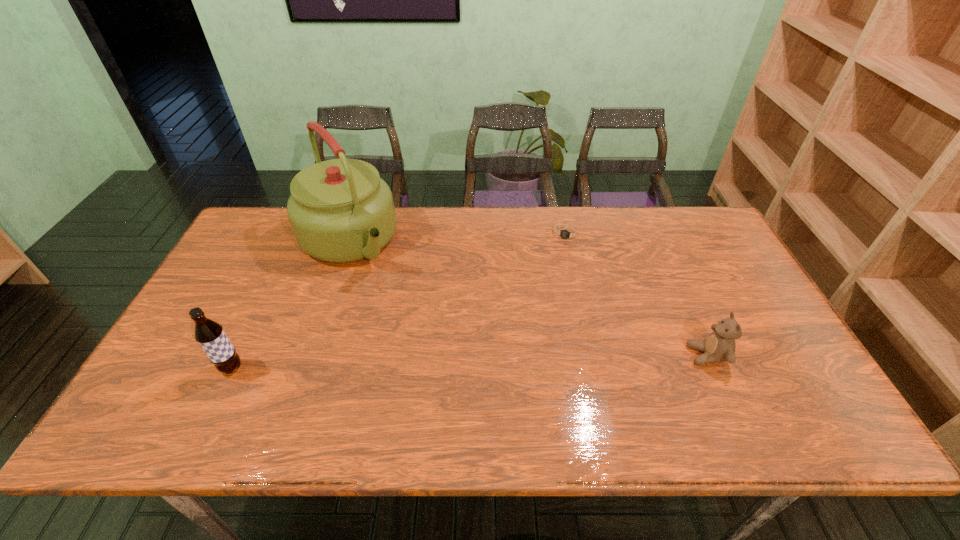
The image size is (960, 540). What are the coordinates of `object at the left edge` in the screenshot? It's located at (210, 335).

Identify the location of object located in the near left corner section of the desktop. (210, 335).

Image resolution: width=960 pixels, height=540 pixels. In the image, there is a desktop. In order to click on blank space at the far edge in this screenshot , I will do `click(512, 209)`.

The width and height of the screenshot is (960, 540). I want to click on free space at the near edge, so click(586, 392).

The height and width of the screenshot is (540, 960). Identify the location of vacant space at the left edge. tap(254, 287).

You are a GUI agent. You are given a task and a screenshot of the screen. Output one action in this format:
    pyautogui.click(x=<x>, y=<y>)
    Task: Click on the free space at the right edge
    The image size is (960, 540).
    Given the screenshot: What is the action you would take?
    pyautogui.click(x=738, y=303)

The width and height of the screenshot is (960, 540). In order to click on vacant area at the far right corner in this screenshot , I will do `click(708, 218)`.

Identify the location of vacant area between the second shortest object and the third object from left to right. (636, 295).

Identify the location of vacant area that lies between the third shortest object and the rightmost object. The height and width of the screenshot is (540, 960). (469, 362).

The image size is (960, 540). I want to click on free area in between the watch and the kettle, so [457, 238].